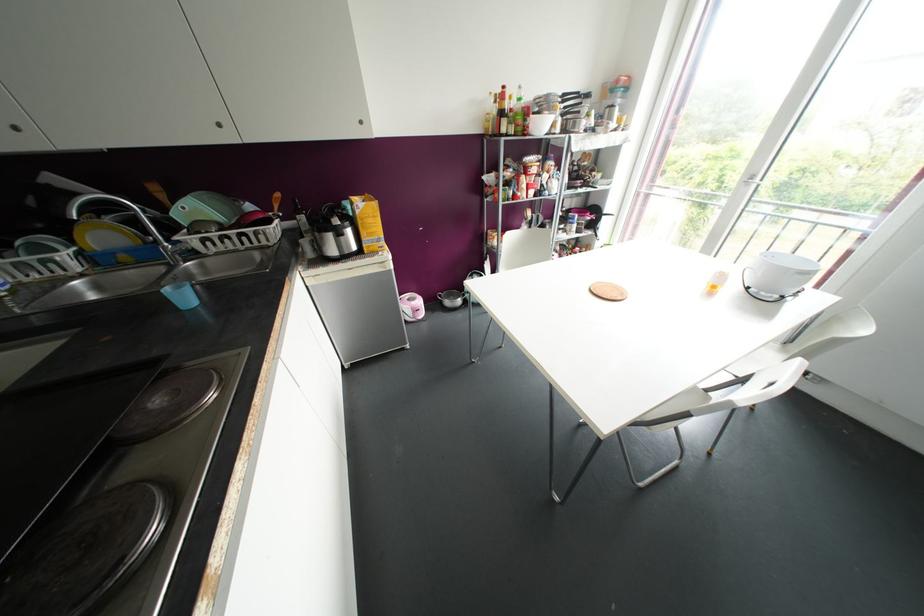
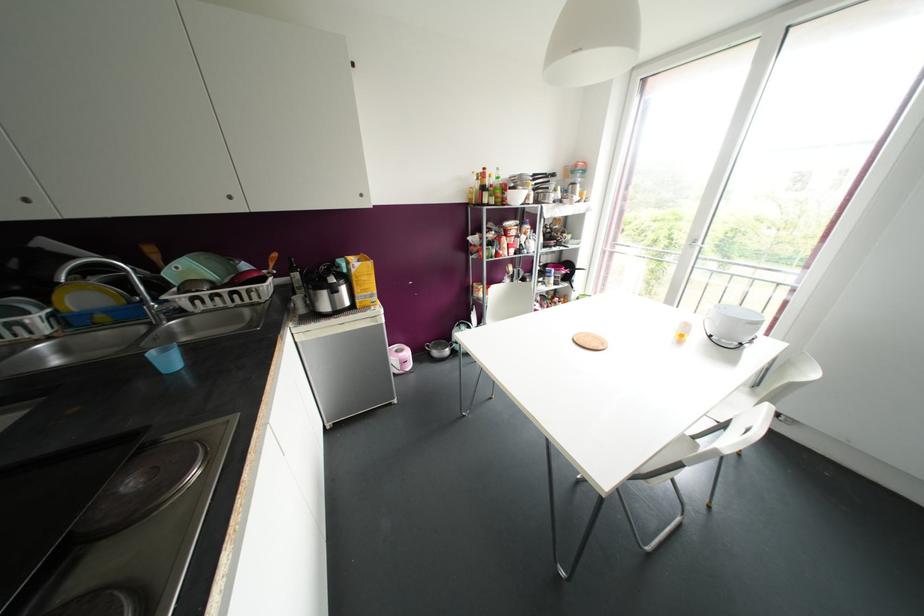
In the second image, find the point that corresponds to point 306,232 in the first image.

(298, 286)